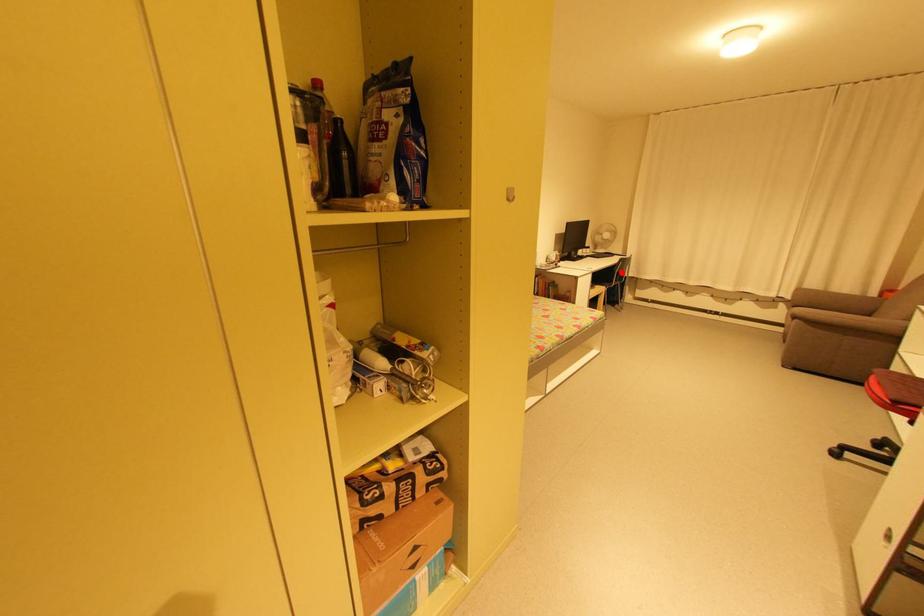
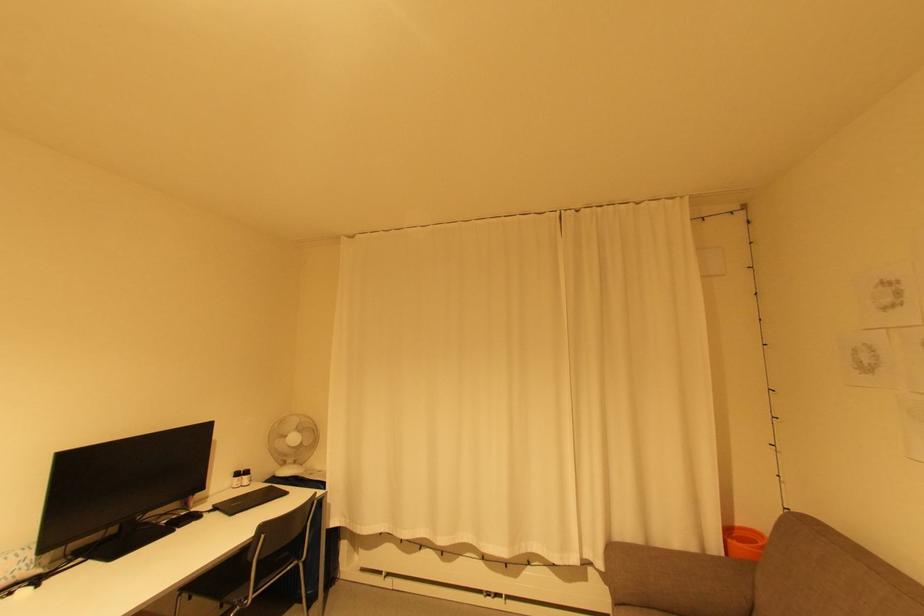
Find the pixel in the second image that matches the highlighted location in the first image.

(262, 562)